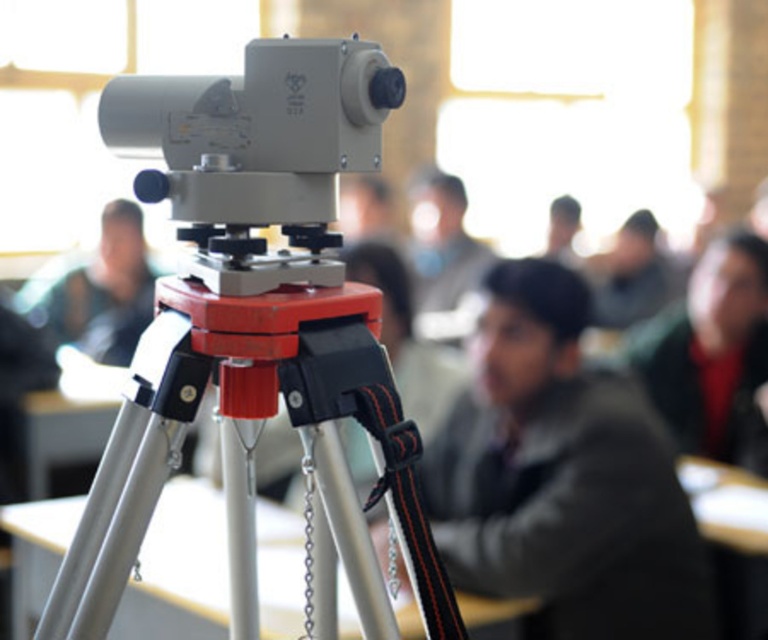
Based on the photo, which is more to the left, dark gray jacket at center or matte black camera at center?

Positioned to the left is matte black camera at center.

Is dark gray jacket at center shorter than matte black camera at center?

No, dark gray jacket at center is not shorter than matte black camera at center.

Who is more distant from viewer, [634,595] or [114,321]?

The point [114,321] is more distant.

The height and width of the screenshot is (640, 768). What are the coordinates of `dark gray jacket at center` in the screenshot? It's located at (561, 477).

Between metallic tripod at center and dark gray jacket at center, which one appears on the right side from the viewer's perspective?

Positioned to the right is dark gray jacket at center.

Who is more forward, (x=101, y=554) or (x=594, y=497)?

Point (x=101, y=554)

Locate an element on the screen. metallic tripod at center is located at coordinates (253, 452).

Is metallic tripod at center thinner than matte black camera at center?

Yes.

Between metallic tripod at center and matte black camera at center, which one appears on the left side from the viewer's perspective?

matte black camera at center is more to the left.

Is point (270, 355) positioned before point (116, 218)?

Yes.

Where is `metallic tripod at center`? The width and height of the screenshot is (768, 640). metallic tripod at center is located at coordinates (253, 452).